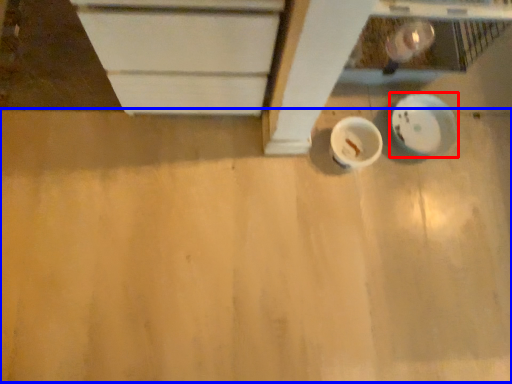
Question: Which object is closer to the camera taking this photo, plate (highlighted by a red box) or plywood (highlighted by a blue box)?

Choices:
 (A) plate
 (B) plywood

Answer: (B)